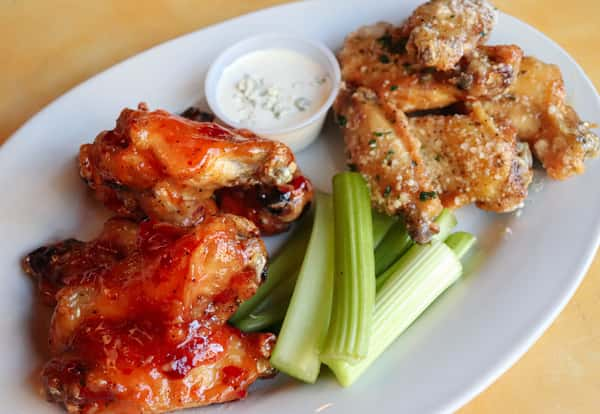
Identify the location of cup. (295, 133).